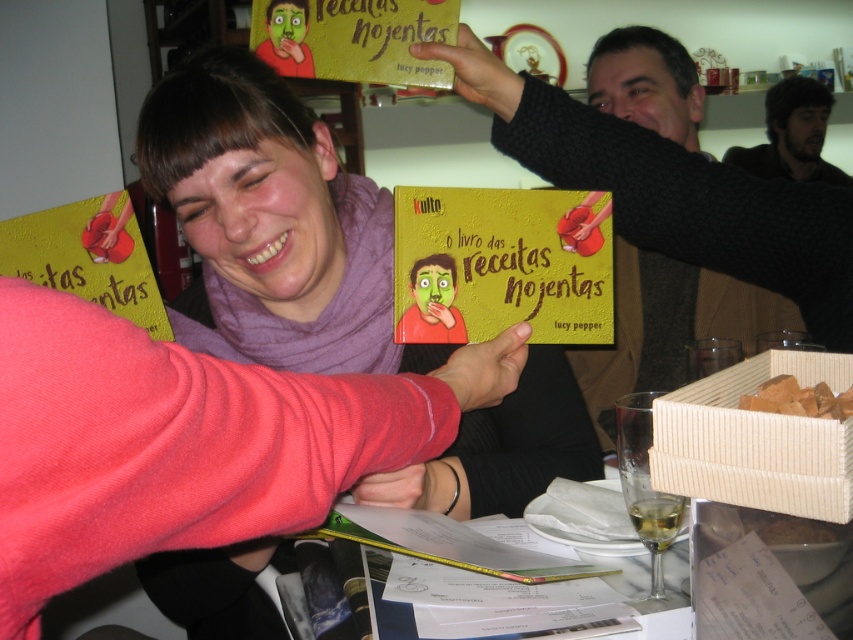
Who is positioned more to the right, beige woven basket at lower right or dark brown hair at upper right?

Positioned to the right is dark brown hair at upper right.

Identify the location of beige woven basket at lower right. (756, 440).

Measure the distance between point (830, 378) and camera.

Point (830, 378) is 57.53 centimeters from camera.

Where is `beige woven basket at lower right`? beige woven basket at lower right is located at coordinates (756, 440).